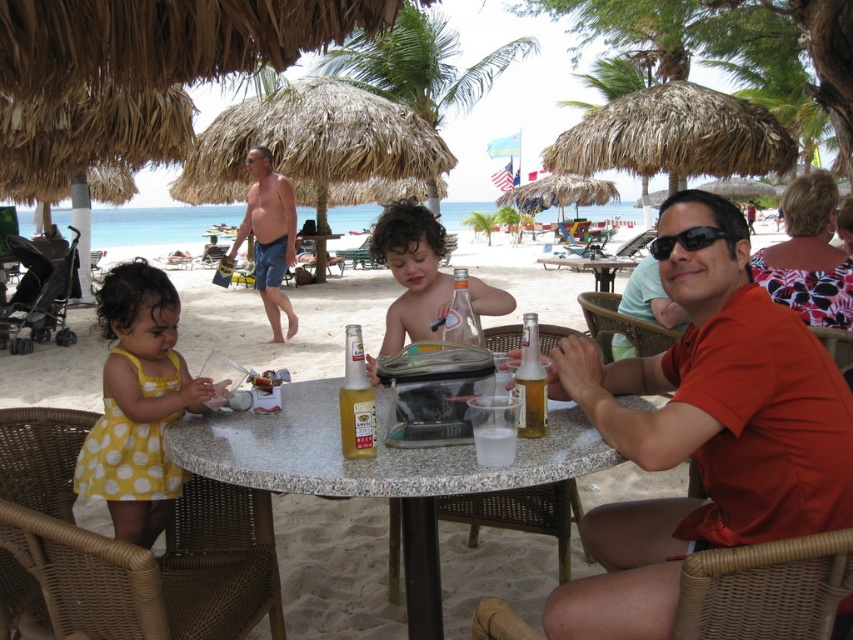
Where is the yellow dotted dress at lower left located in the image?

The yellow dotted dress at lower left is located at point (138,403).